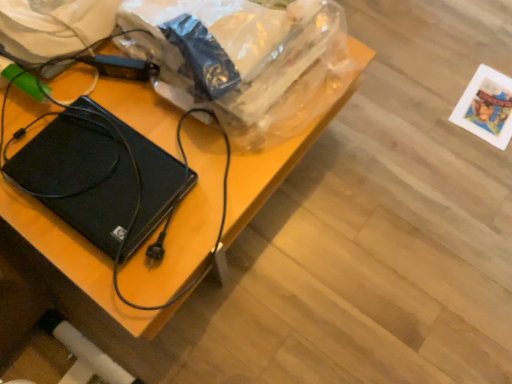
At what (x,y) coordinates should I click in order to perform the action: click on spots to the right of black matte laptop at left. Please return your answer as a coordinate pair (x, y). Looking at the image, I should click on (213, 174).